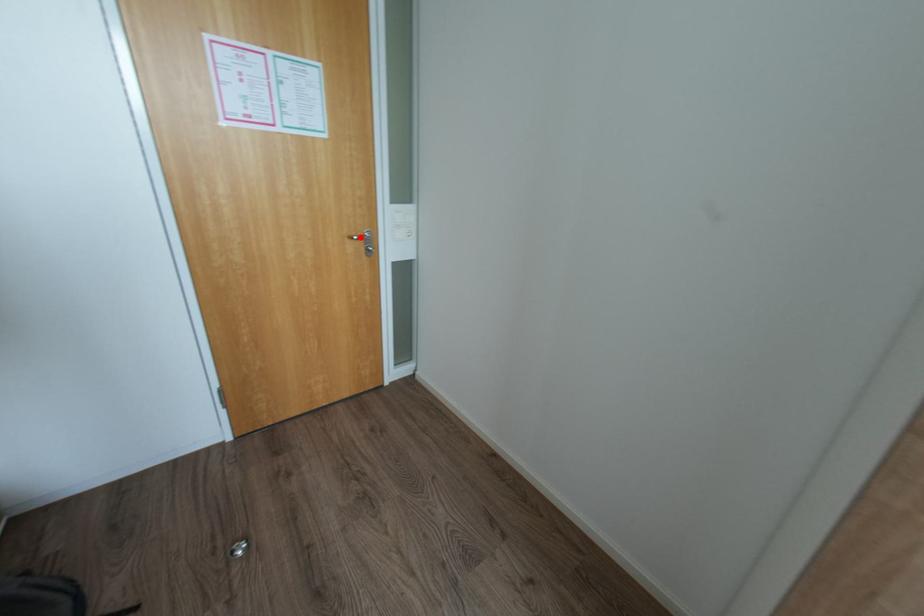
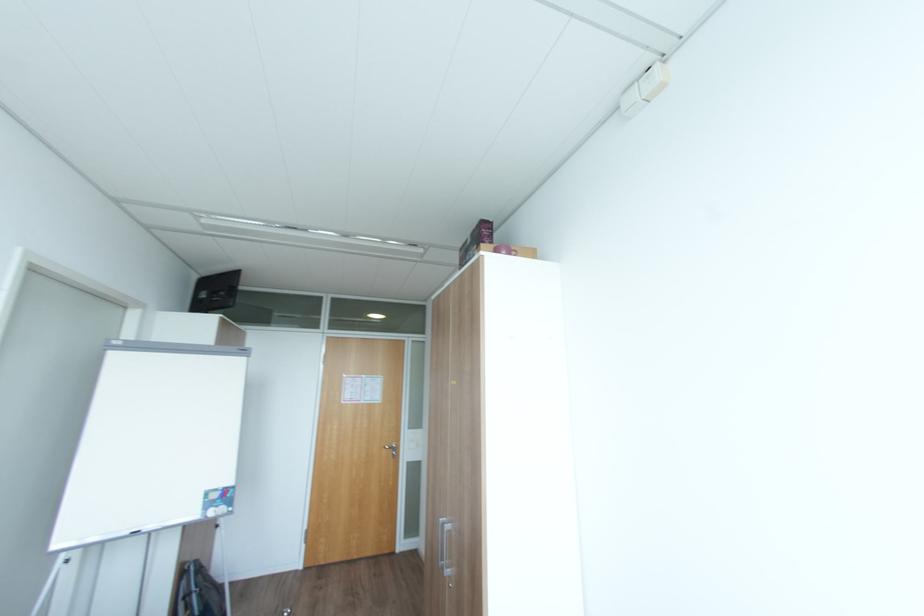
Find the pixel in the second image that matches the highlighted location in the first image.

(392, 448)